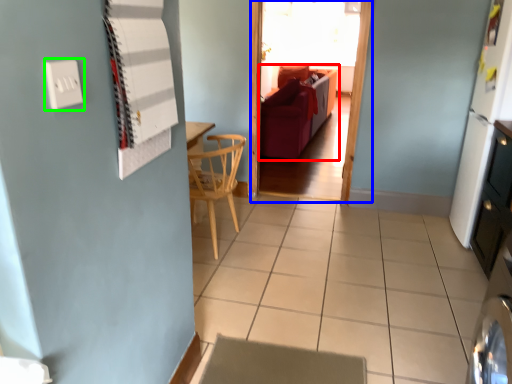
Question: Which is nearer to the studio couch (highlighted by a red box)? glass door (highlighted by a blue box) or electric outlet (highlighted by a green box).

Choices:
 (A) glass door
 (B) electric outlet

Answer: (A)